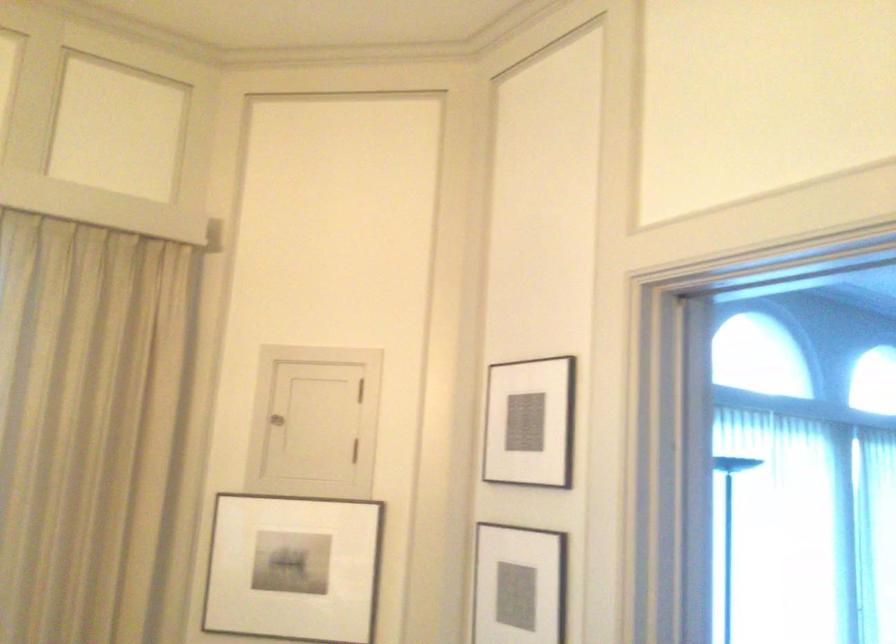
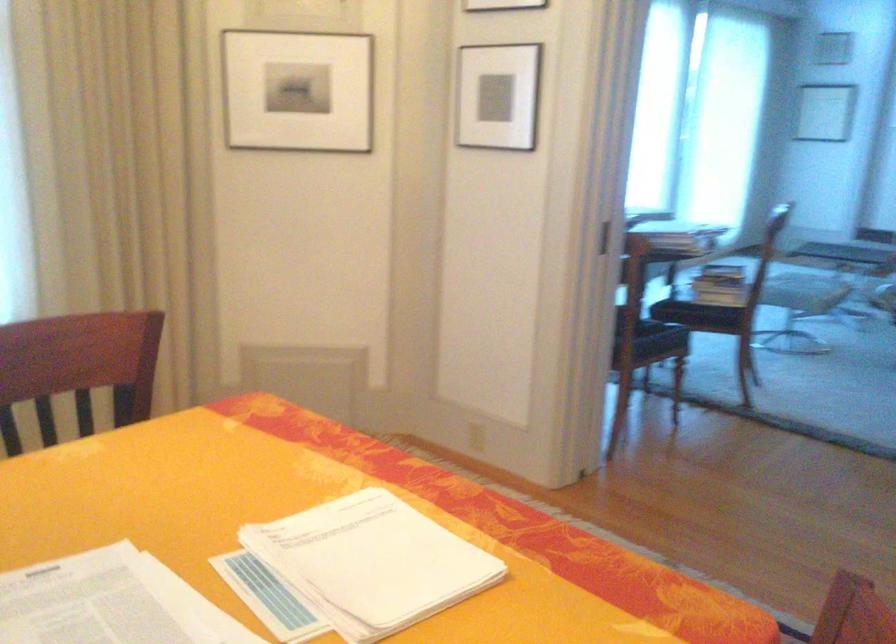
Question: The first image is from the beginning of the video and the second image is from the end. How did the camera likely rotate when shooting the video?

Choices:
 (A) Left
 (B) Right
 (C) Up
 (D) Down

Answer: (D)